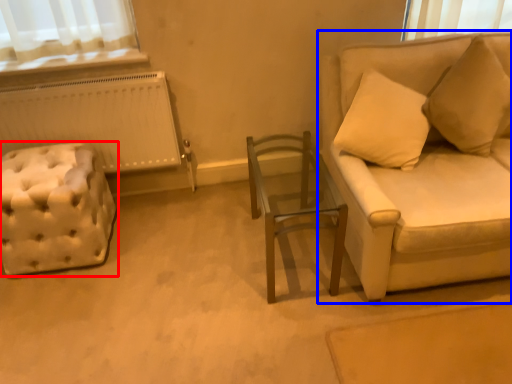
Question: Which point is closer to the camera, furniture (highlighted by a red box) or studio couch (highlighted by a blue box)?

Choices:
 (A) furniture
 (B) studio couch

Answer: (B)